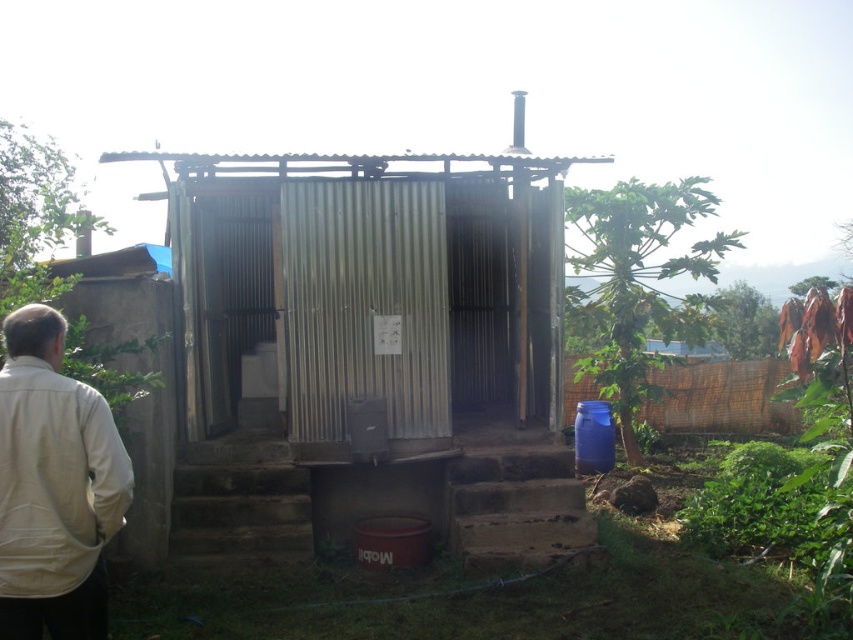
You are standing in the rural area and see the corrugated metal hut at center and the beige fabric jacket at lower left. Which one is positioned to the right side?

The corrugated metal hut at center is positioned to the right of the beige fabric jacket at lower left.

You are standing at the entrance of the outdoor bathroom and want to walk to the point marked at coordinates point (473, 552) and point (9, 468). Which point should you reach first?

You should reach point (9, 468) first because point (473, 552) is behind it.